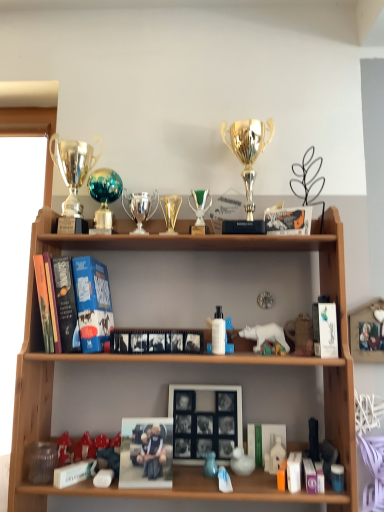
Identify the location of green glass trophy at center, the 2th candle holder in the left-to-right sequence. Image resolution: width=384 pixels, height=512 pixels. (199, 210).

The height and width of the screenshot is (512, 384). What are the coordinates of `shiny silver trophy at upper left, positioned as the first trophy in left-to-right order` in the screenshot? It's located at (73, 169).

Where is `gold shiny trophy at upper center, placed as the 3th trophy when sorted from left to right`? Image resolution: width=384 pixels, height=512 pixels. gold shiny trophy at upper center, placed as the 3th trophy when sorted from left to right is located at coordinates (248, 151).

Find the location of a particular element. This screenshot has width=384, height=512. black matte photo frame at center, positioned as the 3th book in top-to-bottom order is located at coordinates (156, 342).

Where is `teal glass trophy at upper center, the second trophy from the left`? This screenshot has height=512, width=384. teal glass trophy at upper center, the second trophy from the left is located at coordinates (104, 196).

From a real-world perspective, starting from the gold metallic trophy at center, acting as the second candle holder starting from the right, which toy is the 7th one below it? Please provide its 2D coordinates.

[(210, 465)]

Is gold metallic trophy at center, acting as the second candle holder starting from the right, aimed at matte blue vase at lower center, the 7th toy from the right?

No, gold metallic trophy at center, acting as the second candle holder starting from the right, does not turn towards matte blue vase at lower center, the 7th toy from the right.

From the image's perspective, is gold metallic trophy at center, acting as the second candle holder starting from the right, beneath matte blue vase at lower center, the 7th toy from the right?

Incorrect, from the image's perspective, gold metallic trophy at center, acting as the second candle holder starting from the right, is higher than matte blue vase at lower center, the 7th toy from the right.

Which object is positioned more to the left, gold metallic trophy at center, acting as the second candle holder starting from the right, or matte blue vase at lower center, the 7th toy from the right?

gold metallic trophy at center, acting as the second candle holder starting from the right.

Considering the positions of objects teal glass trophy at upper center, positioned as the second trophy in right-to-left order, and white plastic bear at center, which ranks as the 4th toy in right-to-left order, in the image provided, who is more to the right, teal glass trophy at upper center, positioned as the second trophy in right-to-left order, or white plastic bear at center, which ranks as the 4th toy in right-to-left order,?

Positioned to the right is white plastic bear at center, which ranks as the 4th toy in right-to-left order.

Which is behind, teal glass trophy at upper center, the second trophy from the left, or white plastic bear at center, arranged as the 6th toy when viewed from the left?

teal glass trophy at upper center, the second trophy from the left.

Would you say teal glass trophy at upper center, positioned as the second trophy in right-to-left order, is inside or outside white plastic bear at center, arranged as the 6th toy when viewed from the left?

teal glass trophy at upper center, positioned as the second trophy in right-to-left order, is spatially situated outside white plastic bear at center, arranged as the 6th toy when viewed from the left.

Is point (276, 326) positioned behind point (212, 472)?

That is True.

Which is correct: white plastic bear at center, which ranks as the 4th toy in right-to-left order, is inside matte blue vase at lower center, the 7th toy from the right, or outside of it?

white plastic bear at center, which ranks as the 4th toy in right-to-left order, is not enclosed by matte blue vase at lower center, the 7th toy from the right.

Is white plastic bear at center, which ranks as the 4th toy in right-to-left order, in front of or behind matte blue vase at lower center, the 7th toy from the right, in the image?

In the image, white plastic bear at center, which ranks as the 4th toy in right-to-left order, appears behind matte blue vase at lower center, the 7th toy from the right.

From a real-world perspective, which is physically above, white plastic bear at center, which ranks as the 4th toy in right-to-left order, or matte blue vase at lower center, the 7th toy from the right?

From a 3D spatial view, white plastic bear at center, which ranks as the 4th toy in right-to-left order, is above.

Between green matte book at lower center, the 1th book positioned from the bottom, and gold shiny trophy at upper center, which is the 1th trophy from right to left, which one has smaller size?

green matte book at lower center, the 1th book positioned from the bottom, is smaller.

Which of these two, green matte book at lower center, which is counted as the 5th book, starting from the top, or gold shiny trophy at upper center, which is the 1th trophy from right to left, stands taller?

Standing taller between the two is gold shiny trophy at upper center, which is the 1th trophy from right to left.

In the image, is green matte book at lower center, the 3th book positioned from the right, on the left side or the right side of gold shiny trophy at upper center, placed as the 3th trophy when sorted from left to right?

green matte book at lower center, the 3th book positioned from the right, is positioned on gold shiny trophy at upper center, placed as the 3th trophy when sorted from left to right,'s right side.

Is the depth of green matte book at lower center, the 3th book positioned from the left, less than that of gold shiny trophy at upper center, placed as the 3th trophy when sorted from left to right?

No, green matte book at lower center, the 3th book positioned from the left, is further to the viewer.

From a real-world perspective, relative to shiny silver trophy at upper left, the 3th trophy viewed from the right, is black matte picture frame at center vertically above or below?

black matte picture frame at center is below shiny silver trophy at upper left, the 3th trophy viewed from the right.

Where is `picture frame in front of the shiny silver trophy at upper left, the 3th trophy viewed from the right`? picture frame in front of the shiny silver trophy at upper left, the 3th trophy viewed from the right is located at coordinates (205, 421).

Could you tell me if black matte picture frame at center is facing shiny silver trophy at upper left, the 3th trophy viewed from the right?

No, black matte picture frame at center is not aimed at shiny silver trophy at upper left, the 3th trophy viewed from the right.

Which is behind, point (231, 446) or point (73, 173)?

The point (73, 173) is behind.

Is point (221, 477) more distant than point (305, 329)?

That is False.

Which object is further away from the camera, matte white figurine at lower center, the sixth toy when ordered from right to left, or matte white bear at center, which is the 1th toy in right-to-left order?

matte white bear at center, which is the 1th toy in right-to-left order, is behind.

Is matte white figurine at lower center, the sixth toy when ordered from right to left, spatially inside matte white bear at center, which appears as the 9th toy when viewed from the left, or outside of it?

matte white figurine at lower center, the sixth toy when ordered from right to left, is not enclosed by matte white bear at center, which appears as the 9th toy when viewed from the left.

How many degrees apart are the facing directions of matte white figurine at lower center, the fourth toy in the left-to-right sequence, and matte white bear at center, which appears as the 9th toy when viewed from the left?

The facing directions of matte white figurine at lower center, the fourth toy in the left-to-right sequence, and matte white bear at center, which appears as the 9th toy when viewed from the left, are 1.02 degrees apart.

Is gold shiny trophy at upper center, which is the 1th trophy from right to left, spatially inside white glossy book at upper right, which is the 5th book in left-to-right order, or outside of it?

gold shiny trophy at upper center, which is the 1th trophy from right to left, lies outside white glossy book at upper right, which is the 5th book in left-to-right order.

Which of these two, gold shiny trophy at upper center, which is the 1th trophy from right to left, or white glossy book at upper right, placed as the 4th book when sorted from bottom to top, is wider?

With larger width is gold shiny trophy at upper center, which is the 1th trophy from right to left.

Considering the relative positions of gold shiny trophy at upper center, which is the 1th trophy from right to left, and white glossy book at upper right, which is the 5th book in left-to-right order, in the image provided, is gold shiny trophy at upper center, which is the 1th trophy from right to left, to the left of white glossy book at upper right, which is the 5th book in left-to-right order, from the viewer's perspective?

Yes.

Considering the relative positions of gold shiny trophy at upper center, placed as the 3th trophy when sorted from left to right, and white glossy book at upper right, placed as the 4th book when sorted from bottom to top, in the image provided, is gold shiny trophy at upper center, placed as the 3th trophy when sorted from left to right, behind white glossy book at upper right, placed as the 4th book when sorted from bottom to top,?

Yes, it is behind white glossy book at upper right, placed as the 4th book when sorted from bottom to top.

This screenshot has height=512, width=384. I want to click on the 4th toy in front of the gold metallic trophy at center, which appears as the first candle holder when viewed from the left, counting from the anchor's position, so click(210, 465).

Which toy is the 4th one when counting from the right side of the teal glass trophy at upper center, positioned as the second trophy in right-to-left order? Please provide its 2D coordinates.

[(265, 335)]

When comparing their distances from green glass trophy at center, the 2th candle holder in the left-to-right sequence, does white matte rubber duck at lower center, acting as the 5th toy starting from the right, or black matte photo frame at center, which is counted as the 3th book, starting from the bottom, seem closer?

Based on the image, black matte photo frame at center, which is counted as the 3th book, starting from the bottom, appears to be nearer to green glass trophy at center, the 2th candle holder in the left-to-right sequence.

In the scene shown: Which object lies nearer to the anchor point green matte book at lower center, the 3th book positioned from the right, white plastic toy at lower right, the second toy viewed from the right, or white matte book at lower right, arranged as the second book when ordered from the bottom?

Among the two, white plastic toy at lower right, the second toy viewed from the right, is located nearer to green matte book at lower center, the 3th book positioned from the right.

From the picture: When comparing their distances from hardcover books at left, the first book from the top, does matte white figurine at lower center, the sixth toy when ordered from right to left, or gold metallic trophy at center, which appears as the first candle holder when viewed from the left, seem closer?

gold metallic trophy at center, which appears as the first candle holder when viewed from the left, is positioned closer to the anchor hardcover books at left, the first book from the top.

From the image, which object appears to be nearer to transparent plastic jar at lower left, which is the 9th toy from right to left, matte white figurine at lower center, the sixth toy when ordered from right to left, or green matte book at lower center, the 3th book positioned from the right?

matte white figurine at lower center, the sixth toy when ordered from right to left.

Considering their positions, is green matte book at lower center, which is counted as the 5th book, starting from the top, positioned closer to teal glass trophy at upper center, positioned as the second trophy in right-to-left order, than matte red toy at lower left, arranged as the second toy when viewed from the left?

matte red toy at lower left, arranged as the second toy when viewed from the left, lies closer to teal glass trophy at upper center, positioned as the second trophy in right-to-left order, than the other object.

From the image, which object appears to be nearer to gold metallic trophy at center, acting as the second candle holder starting from the right, matte white bear at center, which appears as the 9th toy when viewed from the left, or transparent plastic jar at lower left, which is the 9th toy from right to left?

The object closer to gold metallic trophy at center, acting as the second candle holder starting from the right, is matte white bear at center, which appears as the 9th toy when viewed from the left.

Looking at the image, which one is located closer to wooden shelf at center, gold shiny trophy at upper center, which is the 1th trophy from right to left, or black matte photo frame at center, which is counted as the 3th book, starting from the bottom?

black matte photo frame at center, which is counted as the 3th book, starting from the bottom, lies closer to wooden shelf at center than the other object.

Looking at the image, which one is located closer to black matte picture frame at center, green glass trophy at center, placed as the first candle holder when sorted from right to left, or wooden shelf at center?

wooden shelf at center.

I want to click on shelf that lies between black matte photo frame at center, which is counted as the second book, starting from the left, and white matte rubber duck at lower center, marked as the 5th toy in a left-to-right arrangement, from top to bottom, so click(x=183, y=355).

The height and width of the screenshot is (512, 384). What are the coordinates of `picture frame between wooden shelf at center and matte white figurine at lower center, the fourth toy in the left-to-right sequence, in the up-down direction` in the screenshot? It's located at (205, 421).

In order to click on trophy between shiny silver trophy at upper left, positioned as the first trophy in left-to-right order, and green glass trophy at center, the 2th candle holder in the left-to-right sequence, from left to right in this screenshot , I will do `click(104, 196)`.

The height and width of the screenshot is (512, 384). What are the coordinates of `shelf between hardcover books at left, the first book from the left, and white glossy book at upper right, which ranks as the first book in right-to-left order, in the horizontal direction` in the screenshot? It's located at (183, 355).